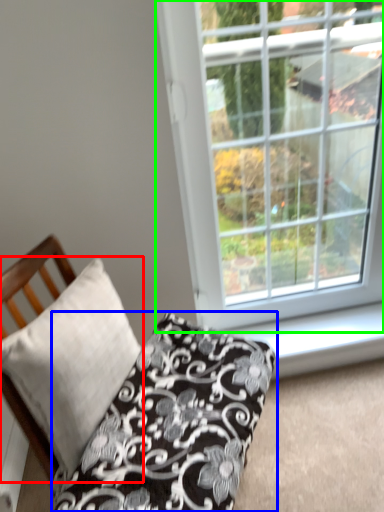
Question: Based on their relative distances, which object is farther from pillow (highlighted by a red box)? Choose from pillow (highlighted by a blue box) and window (highlighted by a green box).

Choices:
 (A) pillow
 (B) window

Answer: (B)